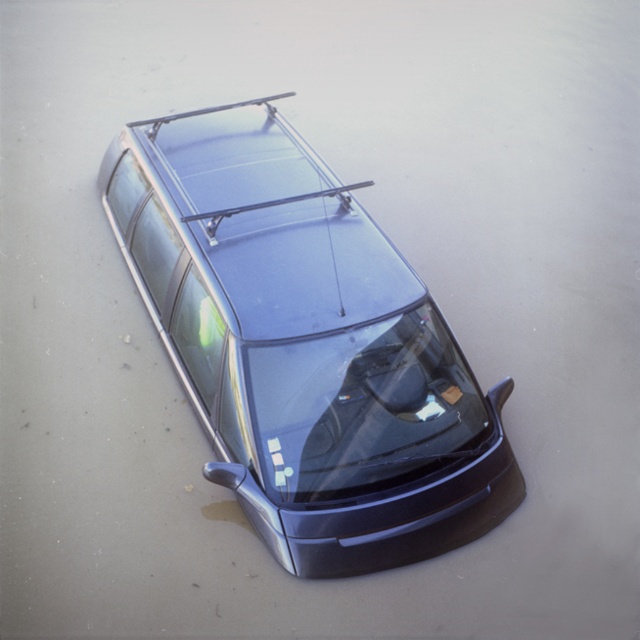
Question: Which point appears farthest from the camera in this image?

Choices:
 (A) (394, 474)
 (B) (433, 554)

Answer: (B)

Question: Does satin black car at center appear over transparent glass windshield at center?

Choices:
 (A) no
 (B) yes

Answer: (B)

Question: Does satin black car at center have a larger size compared to transparent glass windshield at center?

Choices:
 (A) yes
 (B) no

Answer: (A)

Question: Which of the following is the closest to the observer?

Choices:
 (A) satin black car at center
 (B) transparent glass windshield at center

Answer: (A)

Question: Can you confirm if satin black car at center is bigger than transparent glass windshield at center?

Choices:
 (A) yes
 (B) no

Answer: (A)